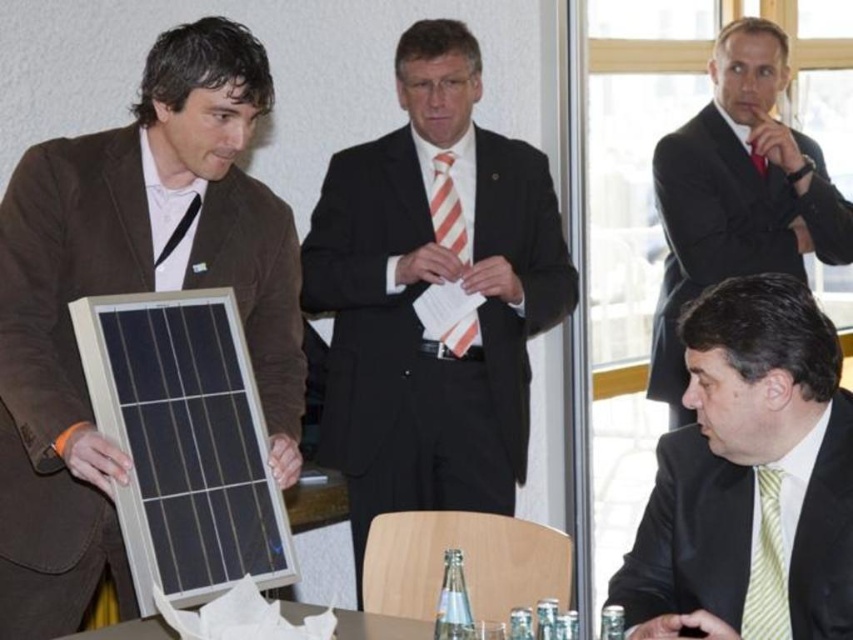
Question: Is green striped tie at lower right below yellow striped tie at lower right?

Choices:
 (A) no
 (B) yes

Answer: (A)

Question: Estimate the real-world distances between objects in this image. Which object is closer to the black suit at upper right?

Choices:
 (A) green striped tie at lower right
 (B) black matte suit at center
 (C) white plastic table at lower center
 (D) yellow striped tie at lower right

Answer: (B)

Question: Can you confirm if green striped tie at lower right is bigger than yellow striped tie at lower right?

Choices:
 (A) no
 (B) yes

Answer: (B)

Question: Which of the following is the closest to the observer?

Choices:
 (A) (16, 483)
 (B) (99, 632)
 (C) (451, 449)

Answer: (B)

Question: Does black suit at upper right come in front of white plastic table at lower center?

Choices:
 (A) no
 (B) yes

Answer: (A)

Question: Which point is closer to the camera taking this photo?

Choices:
 (A) (459, 256)
 (B) (142, 97)
 (C) (708, 168)

Answer: (B)